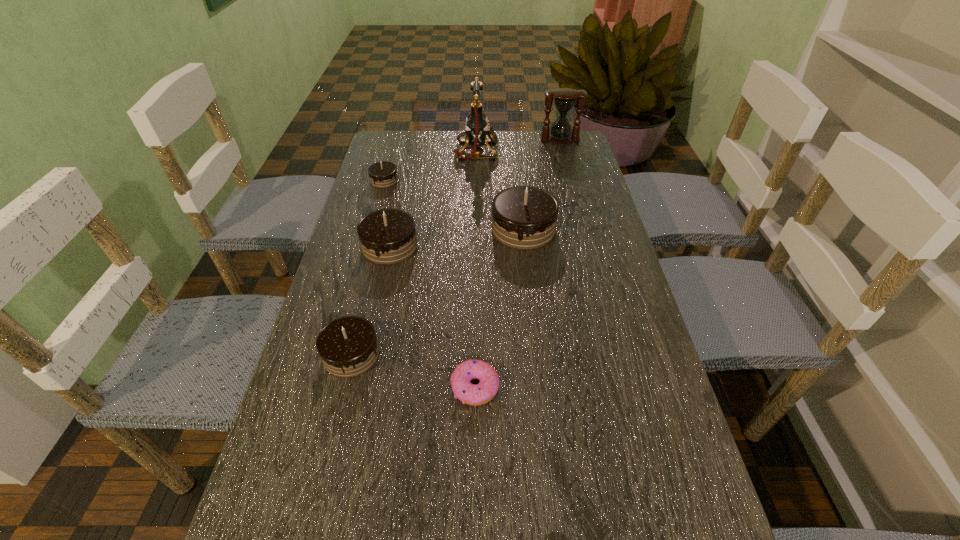
Find the location of a particular element. free space located 0.110m on the front of the seventh tallest object is located at coordinates (474, 465).

The height and width of the screenshot is (540, 960). Find the location of `telephone located at the far edge`. telephone located at the far edge is located at coordinates (477, 127).

I want to click on hourglass that is at the far edge, so click(x=565, y=99).

This screenshot has width=960, height=540. In order to click on hourglass at the right edge in this screenshot , I will do `click(565, 99)`.

Where is `chocolate cake located in the right edge section of the desktop`? The height and width of the screenshot is (540, 960). chocolate cake located in the right edge section of the desktop is located at coordinates (523, 217).

This screenshot has height=540, width=960. In order to click on object that is positioned at the far right corner in this screenshot , I will do `click(565, 99)`.

The height and width of the screenshot is (540, 960). Find the location of `vacant space at the far edge of the desktop`. vacant space at the far edge of the desktop is located at coordinates (425, 146).

You are a GUI agent. You are given a task and a screenshot of the screen. Output one action in this format:
    pyautogui.click(x=<x>, y=<y>)
    Task: Click on the free location at the left edge of the desktop
    The height and width of the screenshot is (540, 960).
    Given the screenshot: What is the action you would take?
    pyautogui.click(x=372, y=209)

At what (x,y) coordinates should I click in order to perform the action: click on vacant space at the right edge. Please return your answer as a coordinate pair (x, y). Looking at the image, I should click on (612, 274).

You are a GUI agent. You are given a task and a screenshot of the screen. Output one action in this format:
    pyautogui.click(x=<x>, y=<y>)
    Task: Click on the vacant space at the far left corner of the desktop
    The width and height of the screenshot is (960, 540).
    Given the screenshot: What is the action you would take?
    pyautogui.click(x=380, y=162)